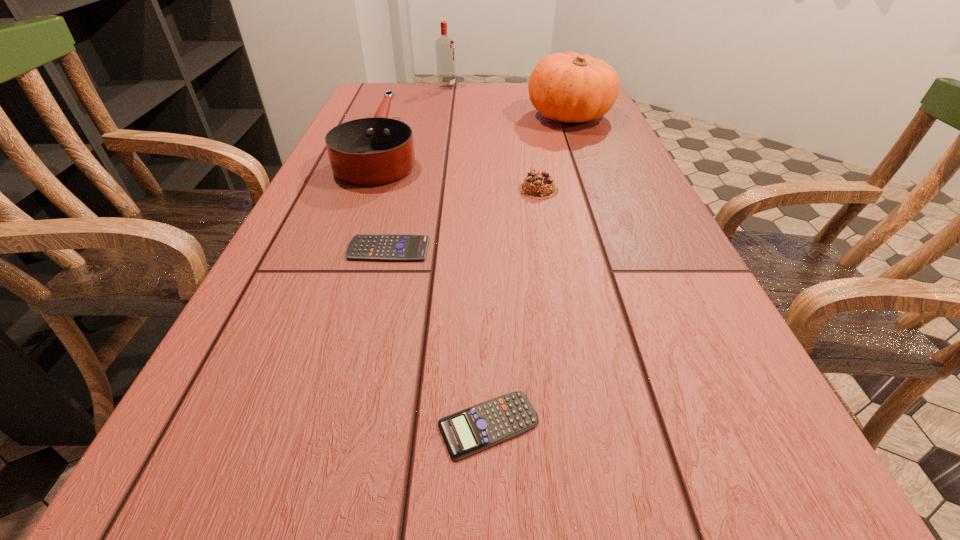
Image resolution: width=960 pixels, height=540 pixels. Identify the location of calculator at the left edge. (395, 247).

Locate an element on the screen. object situated at the right edge is located at coordinates (568, 87).

In order to click on object that is at the far right corner in this screenshot , I will do `click(568, 87)`.

This screenshot has width=960, height=540. In the image, there is a desktop. Find the location of `free region at the far edge`. free region at the far edge is located at coordinates (422, 90).

This screenshot has height=540, width=960. In the image, there is a desktop. Find the location of `free space at the left edge`. free space at the left edge is located at coordinates (337, 246).

At what (x,y) coordinates should I click in order to perform the action: click on free space at the right edge. Please return your answer as a coordinate pair (x, y). Image resolution: width=960 pixels, height=540 pixels. Looking at the image, I should click on (577, 153).

Locate an element on the screen. This screenshot has height=540, width=960. vacant space that is in between the nearest object and the third shortest object is located at coordinates (514, 307).

Where is `empty space that is in between the vodka and the nearest object`? empty space that is in between the vodka and the nearest object is located at coordinates (468, 256).

Find the location of `free space between the nearest object and the chocolate cake`. free space between the nearest object and the chocolate cake is located at coordinates [514, 307].

This screenshot has height=540, width=960. What are the coordinates of `vacant area that lies between the tallest object and the nearest object` in the screenshot? It's located at (468, 256).